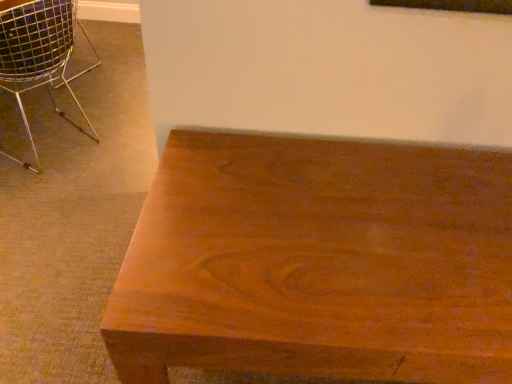
Locate an element on the screen. The height and width of the screenshot is (384, 512). vacant area that is in front of metallic wire chair at left is located at coordinates (45, 195).